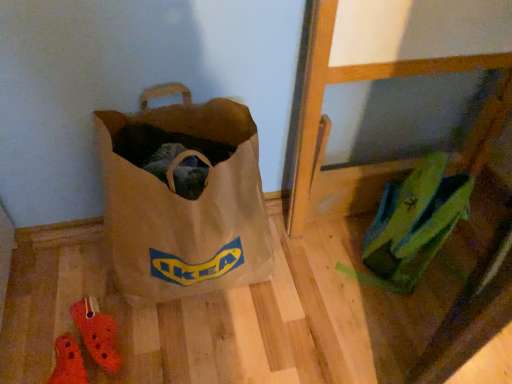
Question: Does rubber crocs at lower left, which is counted as the 1th footwear, starting from the bottom, have a greater height compared to brown canvas bag at lower left?

Choices:
 (A) no
 (B) yes

Answer: (A)

Question: Is rubber crocs at lower left, which ranks as the second footwear in top-to-bottom order, oriented away from brown canvas bag at lower left?

Choices:
 (A) no
 (B) yes

Answer: (A)

Question: From a real-world perspective, is rubber crocs at lower left, which is counted as the 1th footwear, starting from the bottom, on brown canvas bag at lower left?

Choices:
 (A) yes
 (B) no

Answer: (B)

Question: Can you confirm if rubber crocs at lower left, which ranks as the second footwear in top-to-bottom order, is shorter than brown canvas bag at lower left?

Choices:
 (A) yes
 (B) no

Answer: (A)

Question: Can you confirm if rubber crocs at lower left, which is counted as the 1th footwear, starting from the bottom, is smaller than brown canvas bag at lower left?

Choices:
 (A) yes
 (B) no

Answer: (A)

Question: From the image's perspective, is orange croc at lower left, the second footwear positioned from the bottom, above or below brown canvas bag at lower left?

Choices:
 (A) below
 (B) above

Answer: (A)

Question: In terms of size, does orange croc at lower left, the second footwear positioned from the bottom, appear bigger or smaller than brown canvas bag at lower left?

Choices:
 (A) small
 (B) big

Answer: (A)

Question: Is point (106, 362) positioned closer to the camera than point (243, 132)?

Choices:
 (A) farther
 (B) closer

Answer: (B)

Question: In the image, is orange croc at lower left, the second footwear positioned from the bottom, on the left side or the right side of brown canvas bag at lower left?

Choices:
 (A) right
 (B) left

Answer: (B)

Question: Is point (234, 198) closer or farther from the camera than point (104, 329)?

Choices:
 (A) farther
 (B) closer

Answer: (B)

Question: From the image's perspective, is brown canvas bag at lower left positioned above or below orange croc at lower left, the 1th footwear viewed from the top?

Choices:
 (A) below
 (B) above

Answer: (B)

Question: Based on their positions, is brown canvas bag at lower left located to the left or right of orange croc at lower left, the 1th footwear viewed from the top?

Choices:
 (A) right
 (B) left

Answer: (A)

Question: Which is correct: brown canvas bag at lower left is inside orange croc at lower left, the second footwear positioned from the bottom, or outside of it?

Choices:
 (A) inside
 (B) outside

Answer: (B)

Question: Would you say rubber crocs at lower left, which is counted as the 1th footwear, starting from the bottom, is to the left or to the right of brown canvas bag at lower left in the picture?

Choices:
 (A) right
 (B) left

Answer: (B)

Question: In terms of height, does rubber crocs at lower left, which is counted as the 1th footwear, starting from the bottom, look taller or shorter compared to brown canvas bag at lower left?

Choices:
 (A) tall
 (B) short

Answer: (B)